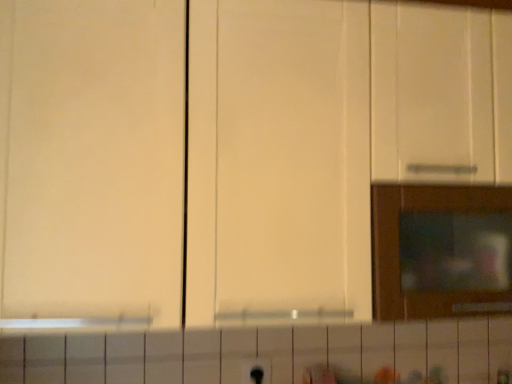
What do you see at coordinates (256, 371) in the screenshot?
I see `black plastic outlet at lower center` at bounding box center [256, 371].

This screenshot has height=384, width=512. What are the coordinates of `black plastic outlet at lower center` in the screenshot? It's located at (256, 371).

Consider the image. Measure the distance between point (258, 376) and camera.

Point (258, 376) and camera are 3.94 feet apart from each other.

What are the coordinates of `black plastic outlet at lower center` in the screenshot? It's located at (256, 371).